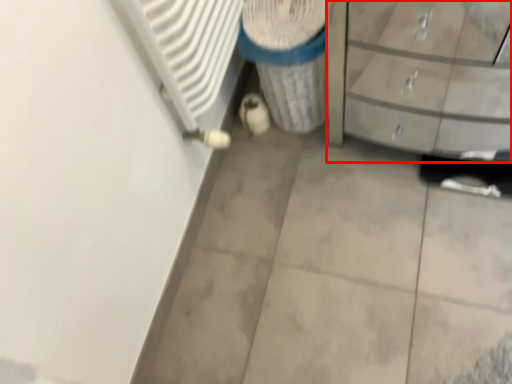
Question: Considering the relative positions of chest of drawers (annotated by the red box) and recycling bin in the image provided, where is chest of drawers (annotated by the red box) located with respect to the staircase?

Choices:
 (A) right
 (B) left

Answer: (A)